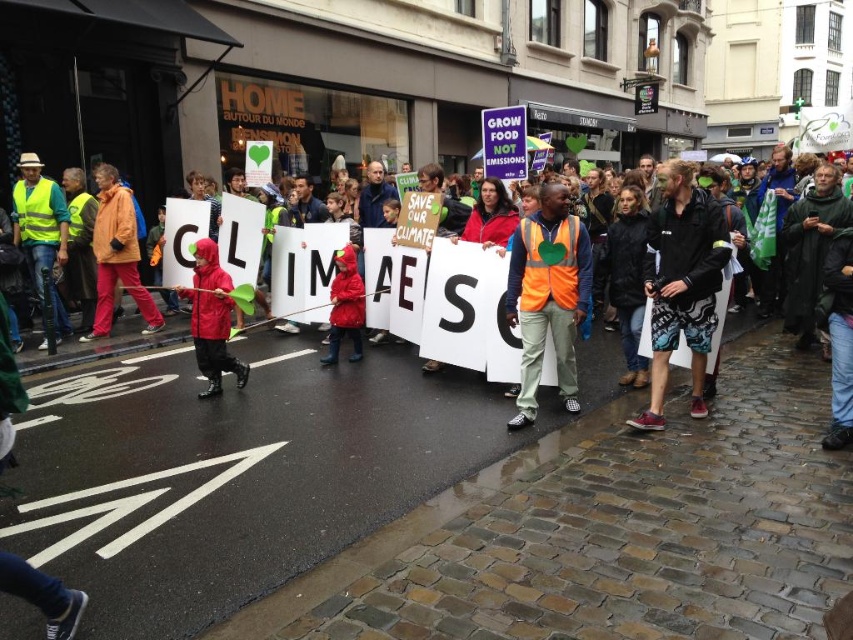
Which is more to the left, black synthetic jacket at center or rubberized red raincoat at center?

rubberized red raincoat at center is more to the left.

Is point (701, 372) farther from viewer compared to point (231, 305)?

No, it is not.

Who is more forward, (712, 301) or (213, 340)?

Positioned in front is point (712, 301).

At what (x,y) coordinates should I click in order to perform the action: click on black synthetic jacket at center. Please return your answer as a coordinate pair (x, y). Looking at the image, I should click on (682, 284).

Which is in front, point (529, 288) or point (91, 330)?

Point (529, 288) is in front.

Does orange reflective vest at center lie in front of orange fabric jacket at left?

Yes, it is in front of orange fabric jacket at left.

Which is behind, point (506, 320) or point (96, 179)?

The point (96, 179) is more distant.

Identify the location of orange reflective vest at center. (547, 296).

Can you confirm if black synthetic jacket at center is positioned below orange fabric jacket at left?

Yes.

Find the location of a particular element. black synthetic jacket at center is located at coordinates (682, 284).